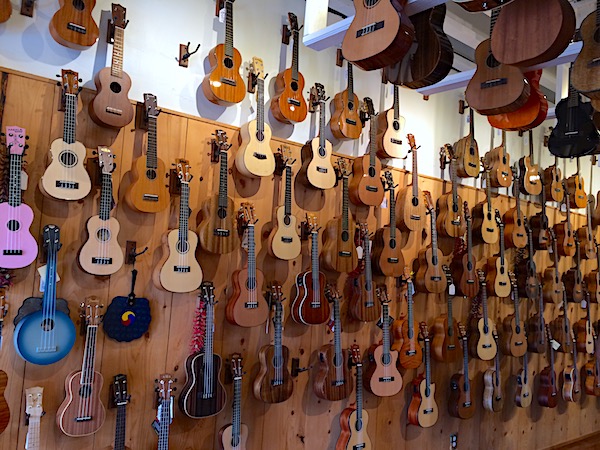
You are a GUI agent. You are given a task and a screenshot of the screen. Output one action in this format:
    pyautogui.click(x=<x>, y=<y>)
    Task: Click on the panelled wall
    
    Given the screenshot: What is the action you would take?
    pyautogui.click(x=517, y=441)